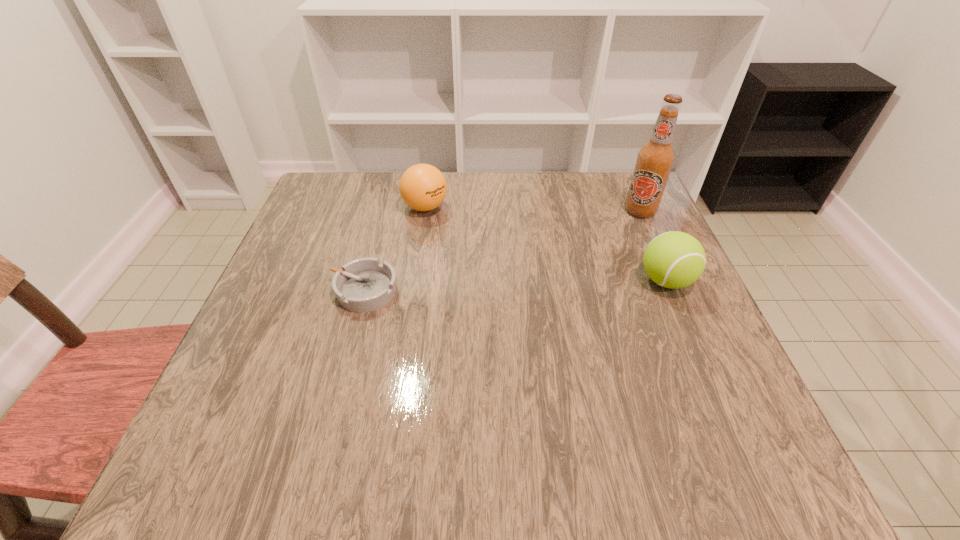
Identify the location of free space at the left edge of the desktop. (323, 239).

Locate an element on the screen. Image resolution: width=960 pixels, height=540 pixels. free space at the right edge is located at coordinates (610, 238).

You are a GUI agent. You are given a task and a screenshot of the screen. Output one action in this format:
    pyautogui.click(x=<x>, y=<y>)
    Task: Click on the vacant space at the far left corner of the desktop
    The height and width of the screenshot is (540, 960).
    Given the screenshot: What is the action you would take?
    pyautogui.click(x=352, y=221)

Locate an element on the screen. vacant area between the ping-pong ball and the beer bottle is located at coordinates (533, 209).

Locate an element on the screen. The width and height of the screenshot is (960, 540). free spot between the tallest object and the ashtray is located at coordinates (502, 251).

This screenshot has width=960, height=540. Identify the location of vacant area that lies between the ping-pong ball and the shortest object. (395, 249).

Locate an element on the screen. free space between the ping-pong ball and the ashtray is located at coordinates (395, 249).

You are a GUI agent. You are given a task and a screenshot of the screen. Output one action in this format:
    pyautogui.click(x=<x>, y=<y>)
    Task: Click on the empty location between the tallest object and the ashtray
    The height and width of the screenshot is (540, 960).
    Given the screenshot: What is the action you would take?
    pyautogui.click(x=502, y=251)

Locate an element on the screen. This screenshot has height=540, width=960. free point between the ashtray and the tallest object is located at coordinates (502, 251).

Identify the location of vacant area that lies between the ping-pong ball and the beer bottle. (533, 209).